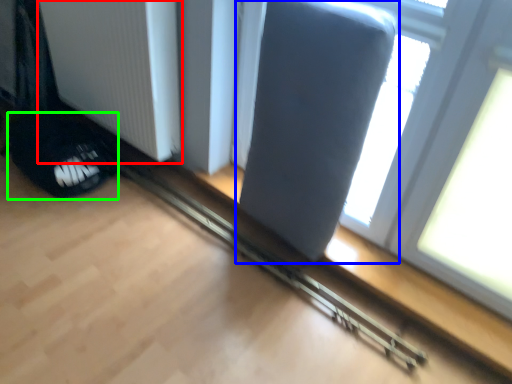
Question: Based on their relative distances, which object is farther from radiator (highlighted by a red box)? Choose from swivel chair (highlighted by a blue box) and footwear (highlighted by a green box).

Choices:
 (A) swivel chair
 (B) footwear

Answer: (A)